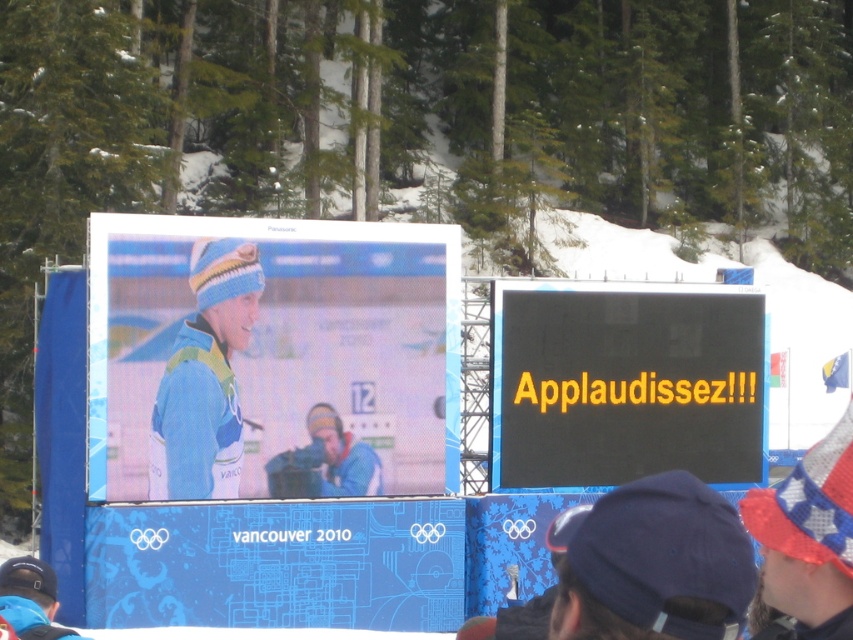
You are a photographer at the Vancouver 2010 Winter Olympics. You want to take a photo of the matte blue jacket at center without the black matte sign at center blocking it. Which object should you move closer to, and which should you move further away from?

To capture the matte blue jacket at center without the black matte sign at center obstructing it, move closer to the matte blue jacket at center and move further away from the black matte sign at center. This adjustment will help reduce the sign blocking the jacket in the frame.

You are standing in front of the two large screens at the Vancouver 2010 Winter Olympics event. There are two points marked on the screens. The first point is at coordinates point (664,461) and the second point is at point (339,488). Which point is closer to you?

Point (664,461) is further to the viewer than point (339,488), so the second point is closer to you.

You are an event organizer at the Vancouver 2010 Winter Olympics. You need to ensure that the two screens displaying the skier are visible to all attendees. Given that the fuzzy knit hat at lower right and the matte blue jacket at center are both visible on the screens, which object would appear bigger to the audience?

The fuzzy knit hat at lower right has a larger size compared to the matte blue jacket at center, so it would appear bigger to the audience.